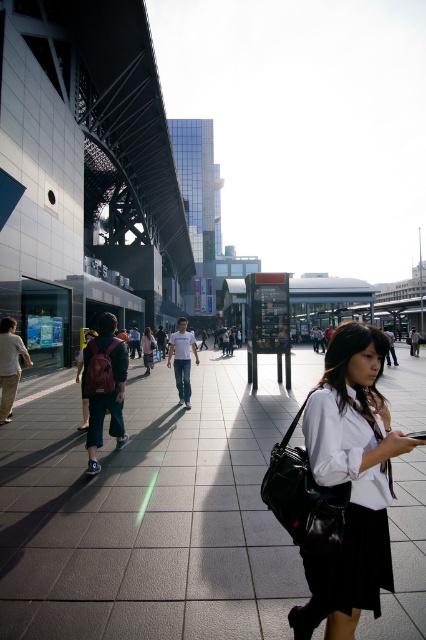
Can you confirm if white shirt at center is positioned below matte white shirt at center?

Actually, white shirt at center is above matte white shirt at center.

The image size is (426, 640). Identify the location of white shirt at center. (351, 481).

Between gray tile pavement at center and matte white shirt at center, which one appears on the right side from the viewer's perspective?

gray tile pavement at center

Is gray tile pavement at center positioned behind matte white shirt at center?

No.

Is point (210, 538) positioned before point (143, 349)?

Yes, point (210, 538) is in front of point (143, 349).

Where is `gray tile pavement at center`? gray tile pavement at center is located at coordinates (150, 509).

Between point (129, 612) and point (370, 486), which one is positioned behind?

Point (129, 612)

Is the position of gray tile pavement at center more distant than that of white shirt at center?

Yes, gray tile pavement at center is further from the viewer.

The image size is (426, 640). What do you see at coordinates (150, 509) in the screenshot?
I see `gray tile pavement at center` at bounding box center [150, 509].

Locate an element on the screen. gray tile pavement at center is located at coordinates (150, 509).